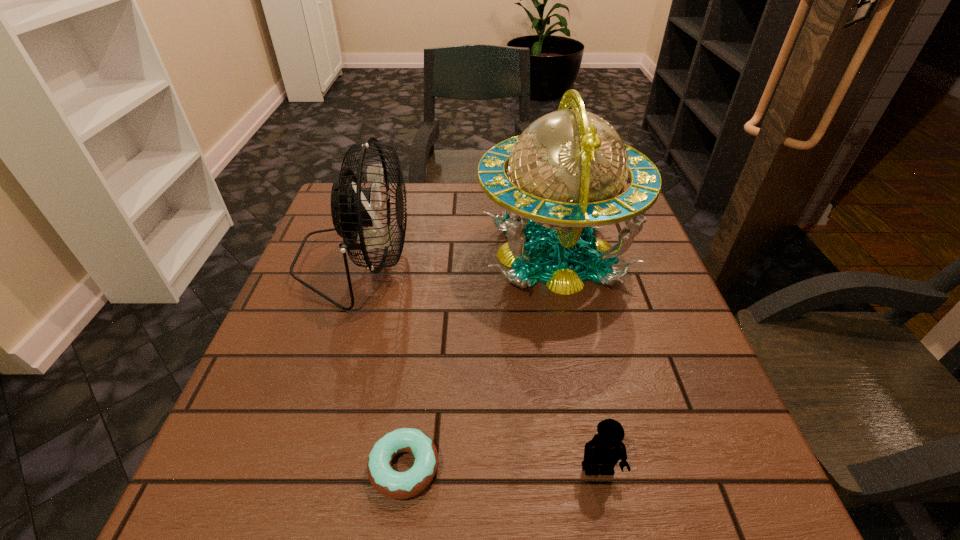
Identify the location of globe. (564, 176).

Where is `fan`? This screenshot has width=960, height=540. fan is located at coordinates (352, 207).

Find the location of a particular element. Lego is located at coordinates (606, 448).

What are the coordinates of `doughnut` in the screenshot? It's located at (396, 485).

The height and width of the screenshot is (540, 960). Identify the location of free spot located on the left of the tallest object. (458, 254).

The width and height of the screenshot is (960, 540). Find the location of `vacant space located 0.170m in front of the fan, directing airflow`. vacant space located 0.170m in front of the fan, directing airflow is located at coordinates (480, 262).

What are the coordinates of `vacant region located on the right of the doughnut` in the screenshot? It's located at (540, 468).

The image size is (960, 540). Find the location of `globe situated at the far edge`. globe situated at the far edge is located at coordinates 564,176.

You are a GUI agent. You are given a task and a screenshot of the screen. Output one action in this format:
    pyautogui.click(x=<x>, y=<y>)
    Task: Click on the fan that is at the far edge
    The image size is (960, 540).
    Given the screenshot: What is the action you would take?
    pyautogui.click(x=352, y=207)

I want to click on Lego that is at the near edge, so click(606, 448).